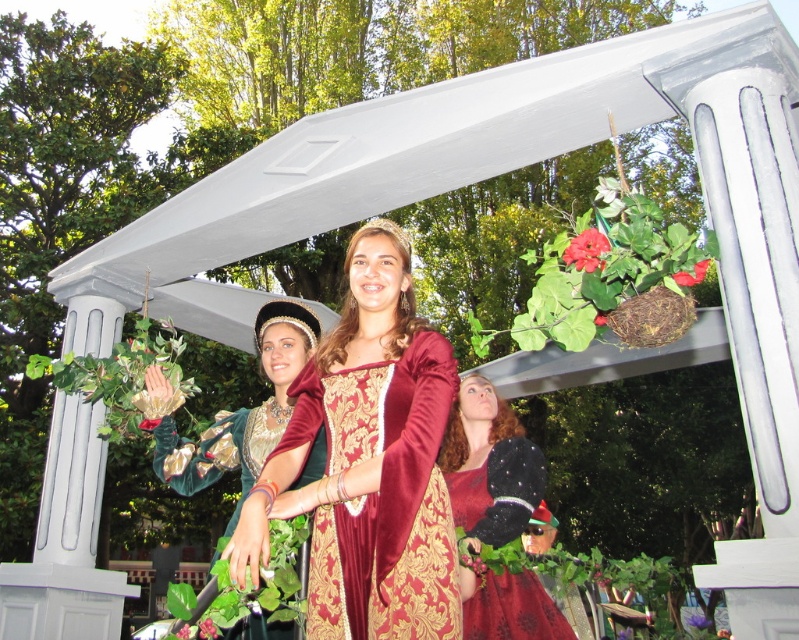
Can you confirm if green leafy plant at center is bigger than red matte flower at upper center?

Indeed, green leafy plant at center has a larger size compared to red matte flower at upper center.

Which is in front, point (142, 429) or point (601, 323)?

Point (601, 323) is more forward.

Identify the location of green leafy plant at center. The height and width of the screenshot is (640, 799). (149, 422).

Who is higher up, red matte flower at center or pink matte flower at center?

Positioned higher is pink matte flower at center.

Which of these two, red matte flower at center or pink matte flower at center, stands taller?

red matte flower at center

Who is more forward, [481,566] or [189,627]?

Point [189,627]

Find the location of a particular element. This screenshot has width=799, height=640. red matte flower at center is located at coordinates (472, 563).

Does red matte flower at center appear on the left side of green leafy plant at center?

No, red matte flower at center is not to the left of green leafy plant at center.

Which of these two, red matte flower at center or green leafy plant at center, stands taller?

With more height is red matte flower at center.

Between point (472, 557) and point (161, 417), which one is positioned in front?

Point (472, 557)

Find the location of a particular element. red matte flower at center is located at coordinates (472, 563).